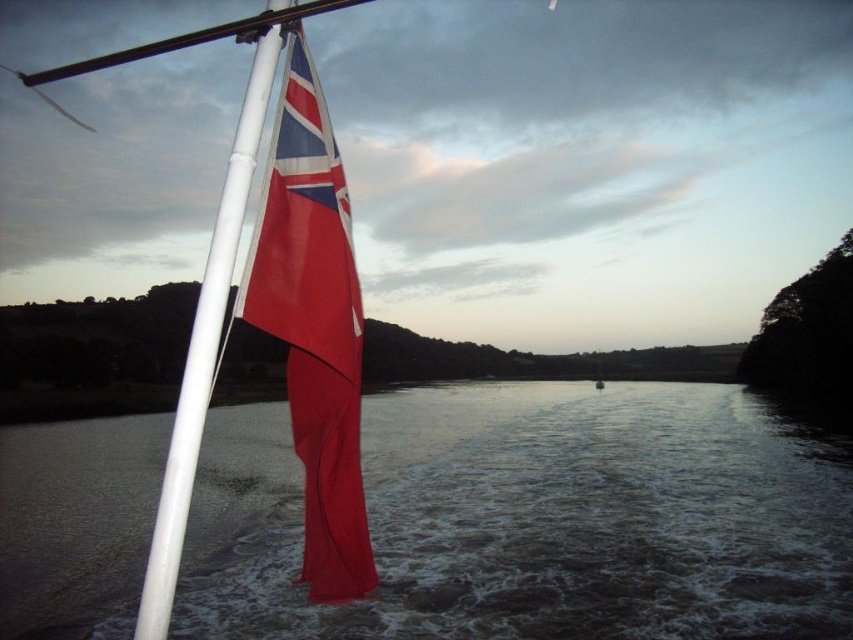
Can you confirm if smooth water at lower left is thinner than white glossy flag pole at upper left?

In fact, smooth water at lower left might be wider than white glossy flag pole at upper left.

Is point (463, 417) positioned after point (219, 307)?

Yes, point (463, 417) is behind point (219, 307).

The height and width of the screenshot is (640, 853). Describe the element at coordinates (537, 518) in the screenshot. I see `smooth water at lower left` at that location.

Locate an element on the screen. This screenshot has width=853, height=640. smooth water at lower left is located at coordinates (537, 518).

Measure the distance between textured fabric flag at left and white glossy flag pole at upper left.

They are 10.29 meters apart.

Which is below, textured fabric flag at left or white glossy flag pole at upper left?

white glossy flag pole at upper left

Which is behind, point (328, 236) or point (254, 120)?

The point (328, 236) is more distant.

Locate an element on the screen. The height and width of the screenshot is (640, 853). textured fabric flag at left is located at coordinates (312, 324).

Does smooth water at lower left appear over textured fabric flag at left?

Actually, smooth water at lower left is below textured fabric flag at left.

Where is `smooth water at lower left`? Image resolution: width=853 pixels, height=640 pixels. smooth water at lower left is located at coordinates (537, 518).